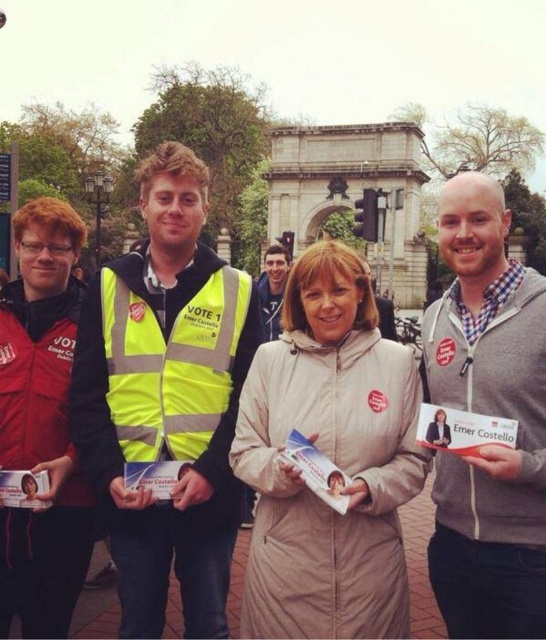
You are a photographer trying to capture a clear shot of the gray zip up hoodie at center. There is an obstruction at point (488,413). Can you tell me if the obstruction is in front of or behind the gray zip up hoodie at center?

The obstruction at point (488,413) is exactly where the gray zip up hoodie at center is located, so the obstruction is at the same position as the gray zip up hoodie at center.

You are a photographer adjusting your camera settings to capture the scene. You notice two points in the image at coordinates point (x=307, y=518) and point (x=26, y=515). Which point should you focus on to ensure the foreground subject is sharp?

Point (x=307, y=518) is closer to the camera than point (x=26, y=515), so focusing on point (x=307, y=518) will ensure the foreground subject is sharp.